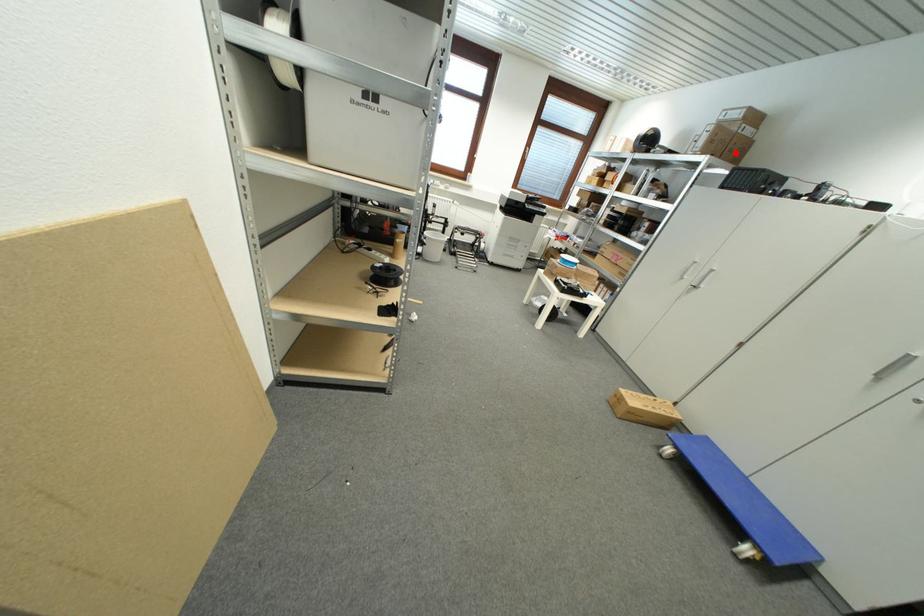
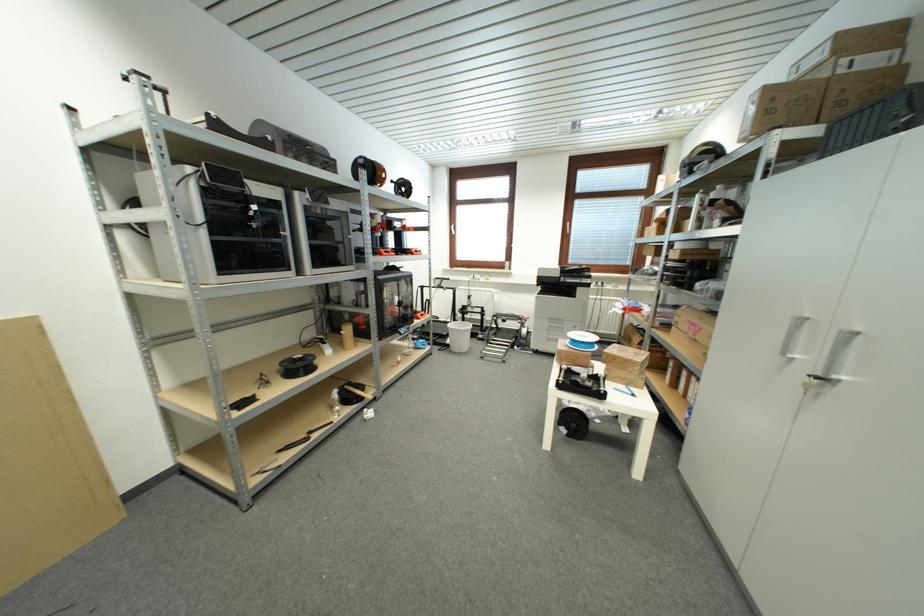
Locate, in the second image, the point that corresponds to the highlighted location in the first image.

(845, 106)